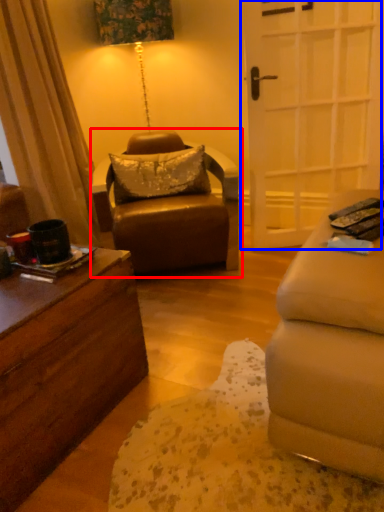
Question: Which object is closer to the camera taking this photo, chair (highlighted by a red box) or door (highlighted by a blue box)?

Choices:
 (A) chair
 (B) door

Answer: (A)